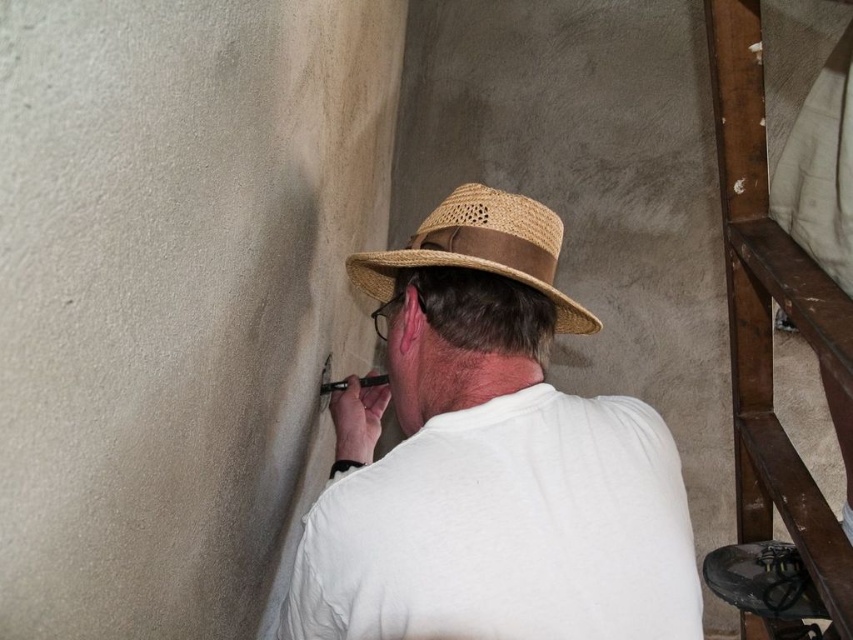
You are standing in front of the wall where the person is working. Which object, the white matte shirt at center or the straw hat at center, is positioned higher on the person?

The white matte shirt at center is much taller than the straw hat at center, so the white matte shirt at center is positioned higher on the person.